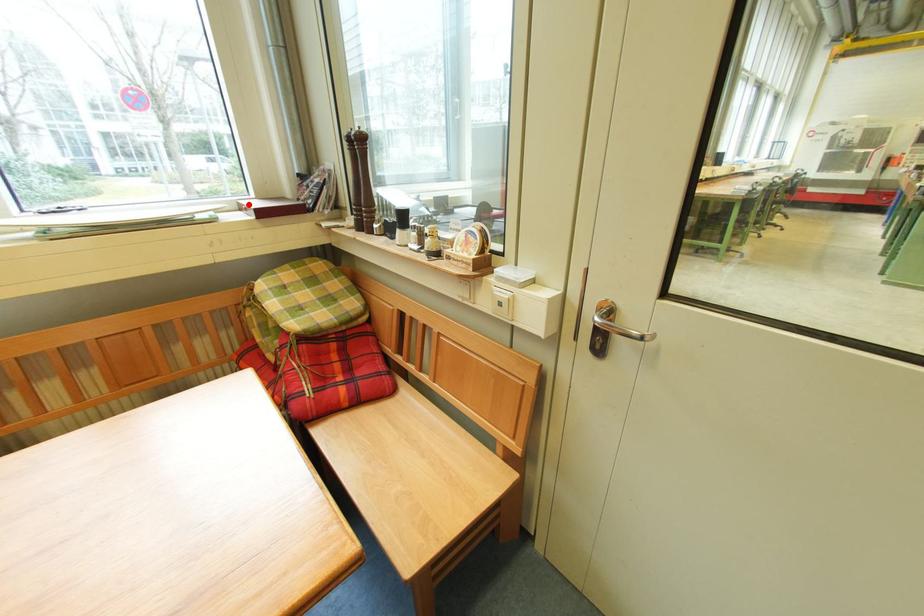
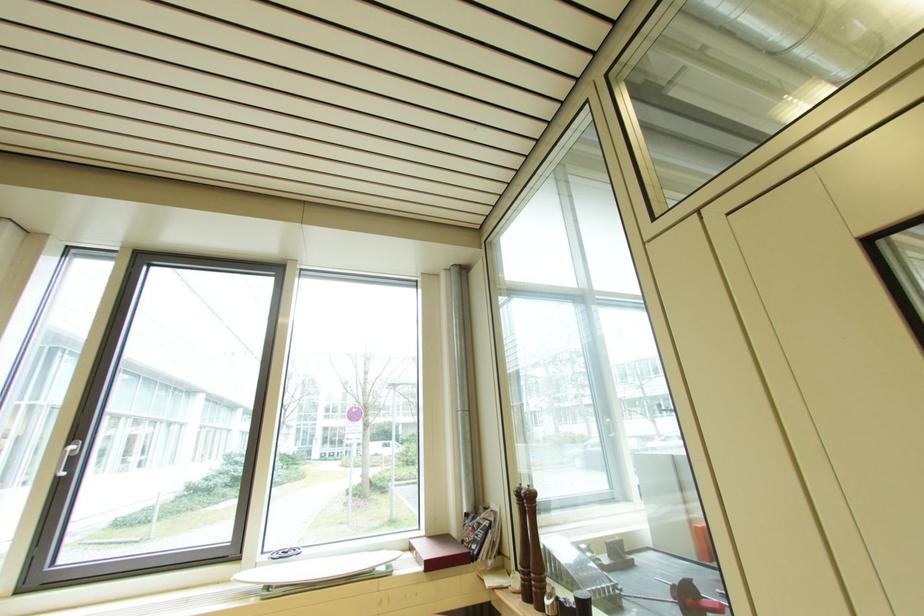
Question: I am providing you with two images of the same scene from different viewpoints. A red point is marked on the first image. Is the red point's position out of view in image 2?

Choices:
 (A) Yes
 (B) No

Answer: (B)